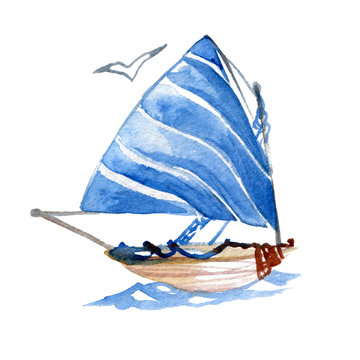
The width and height of the screenshot is (360, 360). Identify the location of picture of a watercolor painting. (63, 46).